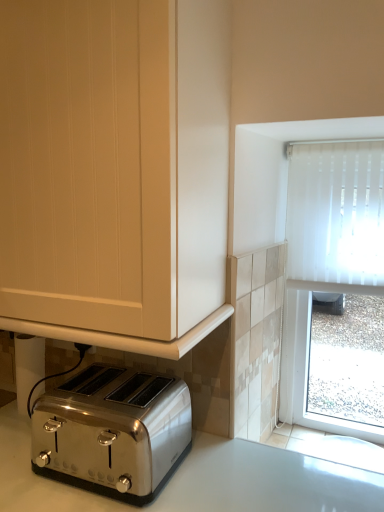
Question: Considering the positions of matte white cabinet at lower left and satin silver toaster at lower left in the image, is matte white cabinet at lower left wider or thinner than satin silver toaster at lower left?

Choices:
 (A) thin
 (B) wide

Answer: (B)

Question: From the image's perspective, is matte white cabinet at lower left located above or below satin silver toaster at lower left?

Choices:
 (A) above
 (B) below

Answer: (A)

Question: Is point (203, 225) positioned closer to the camera than point (119, 414)?

Choices:
 (A) farther
 (B) closer

Answer: (B)

Question: From the image's perspective, is satin silver toaster at lower left located above or below matte white cabinet at lower left?

Choices:
 (A) below
 (B) above

Answer: (A)

Question: Is satin silver toaster at lower left spatially inside matte white cabinet at lower left, or outside of it?

Choices:
 (A) outside
 (B) inside

Answer: (A)

Question: From a real-world perspective, is satin silver toaster at lower left physically located above or below matte white cabinet at lower left?

Choices:
 (A) below
 (B) above

Answer: (A)

Question: In terms of size, does satin silver toaster at lower left appear bigger or smaller than matte white cabinet at lower left?

Choices:
 (A) big
 (B) small

Answer: (B)